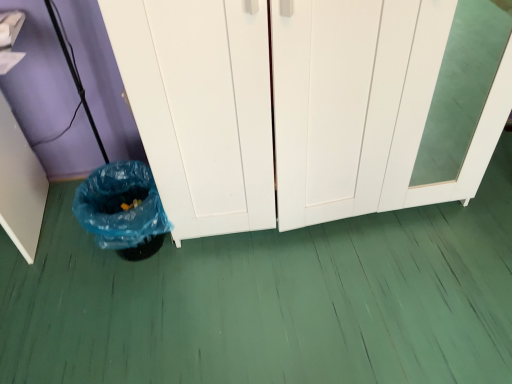
Find the location of a particular element. vacant point to the right of blue plastic bag at lower left is located at coordinates (206, 262).